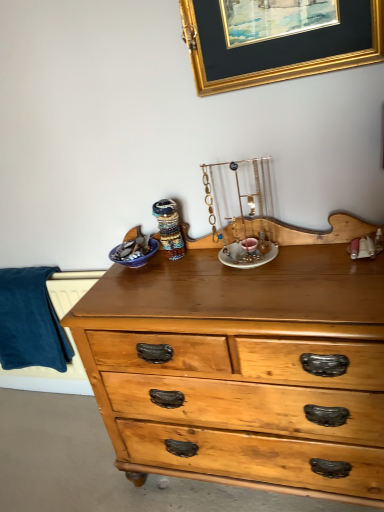
Question: Would you consider gold/glossy picture frame at upper center to be distant from blue soft fabric at left?

Choices:
 (A) yes
 (B) no

Answer: (A)

Question: Is gold/glossy picture frame at upper center closer to the viewer compared to blue soft fabric at left?

Choices:
 (A) no
 (B) yes

Answer: (B)

Question: Is gold/glossy picture frame at upper center wider than blue soft fabric at left?

Choices:
 (A) yes
 (B) no

Answer: (B)

Question: Is gold/glossy picture frame at upper center touching blue soft fabric at left?

Choices:
 (A) no
 (B) yes

Answer: (A)

Question: Is gold/glossy picture frame at upper center not within blue soft fabric at left?

Choices:
 (A) yes
 (B) no

Answer: (A)

Question: Does gold/glossy picture frame at upper center have a larger size compared to blue soft fabric at left?

Choices:
 (A) no
 (B) yes

Answer: (A)

Question: Is blue soft fabric at left at the right side of gold/glossy picture frame at upper center?

Choices:
 (A) yes
 (B) no

Answer: (B)

Question: Could you tell me if blue soft fabric at left is turned towards gold/glossy picture frame at upper center?

Choices:
 (A) no
 (B) yes

Answer: (A)

Question: Can you confirm if blue soft fabric at left is bigger than gold/glossy picture frame at upper center?

Choices:
 (A) yes
 (B) no

Answer: (A)

Question: Considering the relative sizes of blue soft fabric at left and gold/glossy picture frame at upper center in the image provided, is blue soft fabric at left shorter than gold/glossy picture frame at upper center?

Choices:
 (A) yes
 (B) no

Answer: (B)

Question: Is blue soft fabric at left positioned before gold/glossy picture frame at upper center?

Choices:
 (A) no
 (B) yes

Answer: (A)

Question: Does blue soft fabric at left have a smaller size compared to gold/glossy picture frame at upper center?

Choices:
 (A) yes
 (B) no

Answer: (B)

Question: Do you think gold/glossy picture frame at upper center is within blue soft fabric at left, or outside of it?

Choices:
 (A) inside
 (B) outside

Answer: (B)